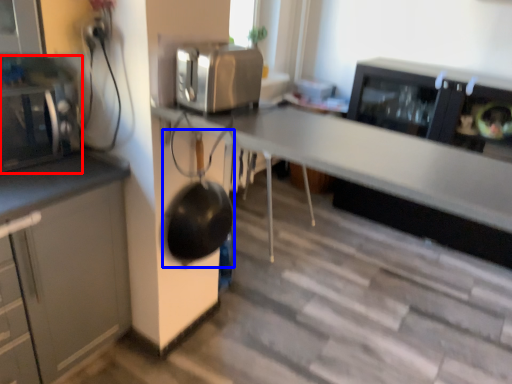
Question: Which object appears closest to the camera in this image, home appliance (highlighted by a red box) or wok (highlighted by a blue box)?

Choices:
 (A) home appliance
 (B) wok

Answer: (A)